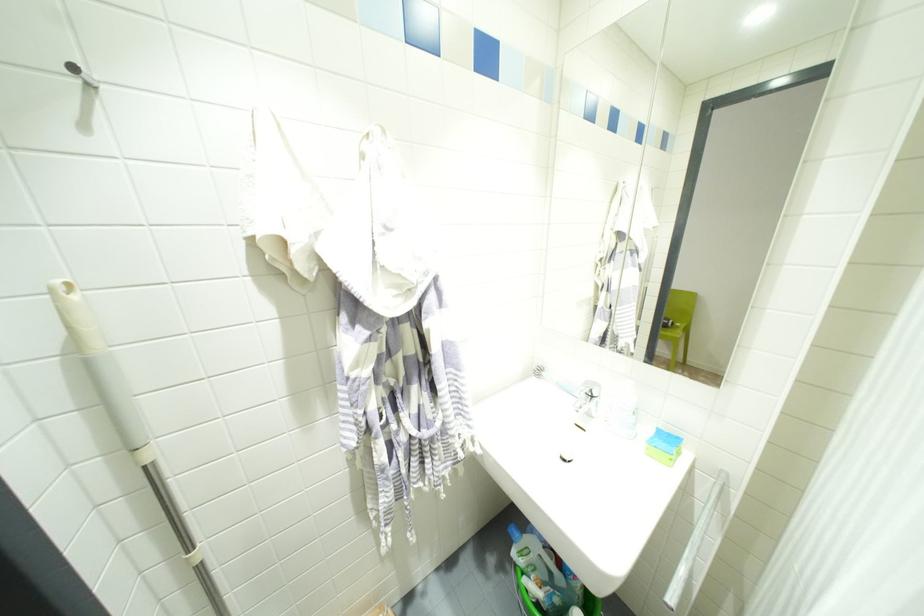
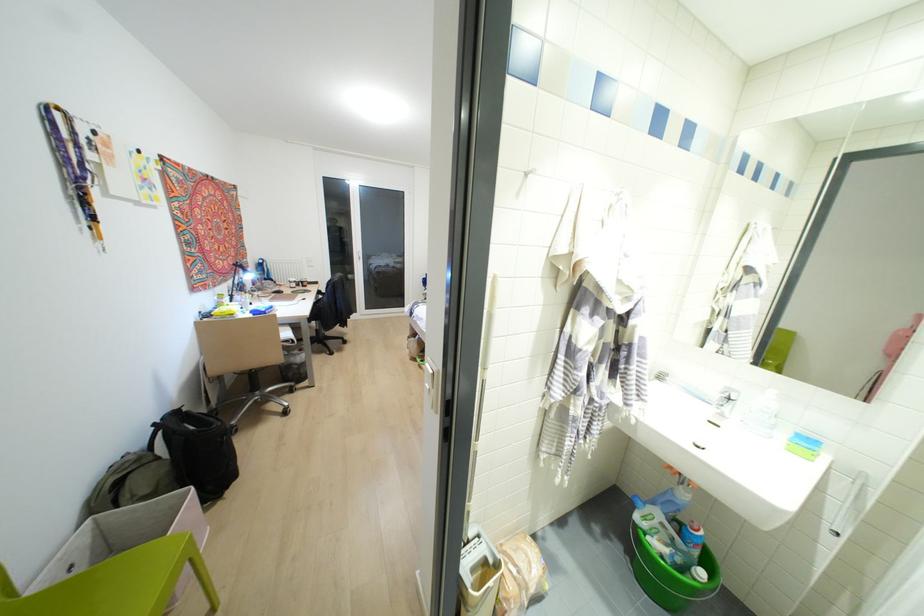
Where in the second image is the point corresponding to [515,564] from the first image?

(636, 525)